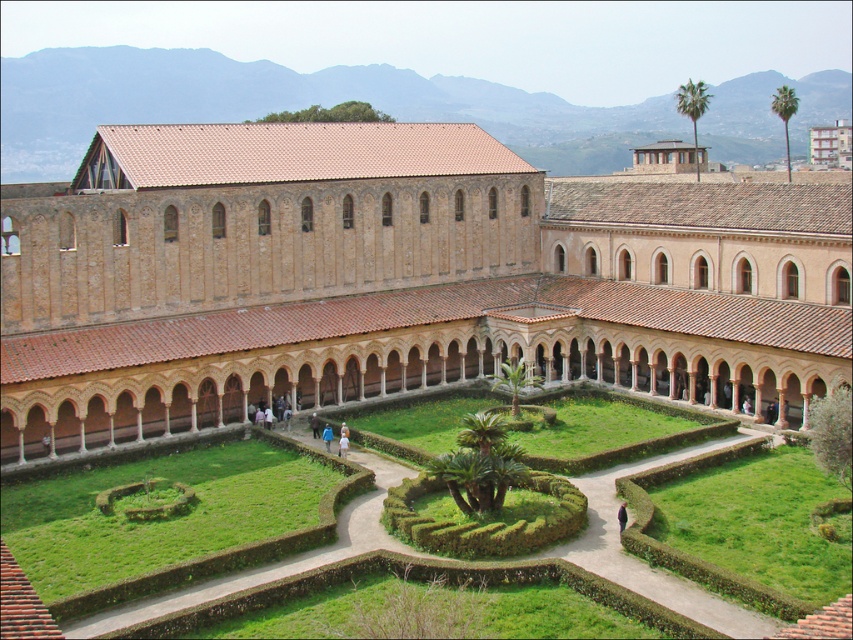
Question: Which point is farther to the camera?

Choices:
 (A) blue fabric at center
 (B) green grass at center

Answer: (A)

Question: Does brown brick building at center come behind blue fabric at center?

Choices:
 (A) yes
 (B) no

Answer: (B)

Question: Estimate the real-world distances between objects in this image. Which object is closer to the brown brick building at center?

Choices:
 (A) blue fabric at center
 (B) green grass at center

Answer: (B)

Question: Which object is farther from the camera taking this photo?

Choices:
 (A) blue fabric at center
 (B) brown brick building at center

Answer: (A)

Question: Does brown brick building at center lie in front of green grass at center?

Choices:
 (A) yes
 (B) no

Answer: (B)

Question: Does brown brick building at center lie behind green grass at center?

Choices:
 (A) yes
 (B) no

Answer: (A)